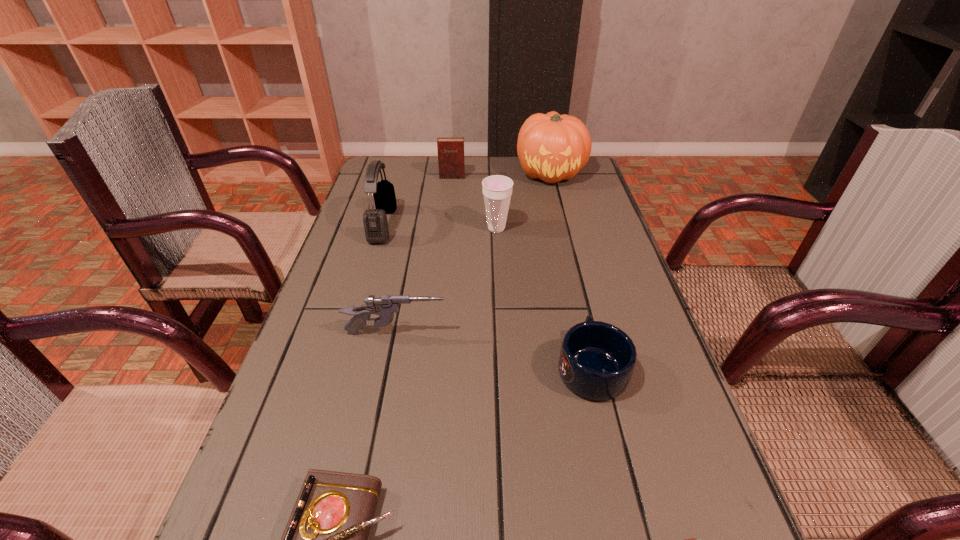
Identify the location of pumpkin. (552, 147).

You are a GUI agent. You are given a task and a screenshot of the screen. Output one action in this format:
    pyautogui.click(x=<x>, y=<y>)
    Task: Click on the headset
    This screenshot has height=540, width=960.
    Given the screenshot: What is the action you would take?
    pyautogui.click(x=375, y=222)

Image resolution: width=960 pixels, height=540 pixels. I want to click on cup, so click(x=497, y=189).

You are a GUI agent. You are given a task and a screenshot of the screen. Output one action in this format:
    pyautogui.click(x=<x>, y=<y>)
    Task: Click on the farther diary
    The width and height of the screenshot is (960, 540).
    Given the screenshot: What is the action you would take?
    pyautogui.click(x=451, y=164)

Image resolution: width=960 pixels, height=540 pixels. Identify the location of gun. (385, 306).

Identify the location of the sixth tallest object. This screenshot has height=540, width=960. (597, 359).

Identify the location of free point located 0.170m on the carved face of the pumpkin. This screenshot has width=960, height=540. (564, 223).

Where is `vacant region located on the headband of the headset`? vacant region located on the headband of the headset is located at coordinates (455, 225).

At what (x,y) coordinates should I click in order to perform the action: click on vacant space located on the back of the cup. Please return your answer as a coordinate pair (x, y). The width and height of the screenshot is (960, 540). Looking at the image, I should click on (493, 165).

You are a GUI agent. You are given a task and a screenshot of the screen. Output one action in this format:
    pyautogui.click(x=<x>, y=<y>)
    Task: Click on the free region located on the front cover of the farther diary
    This screenshot has width=960, height=540.
    Given the screenshot: What is the action you would take?
    pyautogui.click(x=450, y=190)